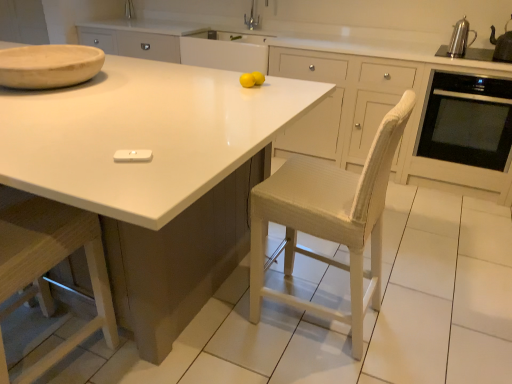
Where is `free point to the right of white matte remote control at center, which appears as the first appliance when viewed from the front`? This screenshot has width=512, height=384. free point to the right of white matte remote control at center, which appears as the first appliance when viewed from the front is located at coordinates click(187, 161).